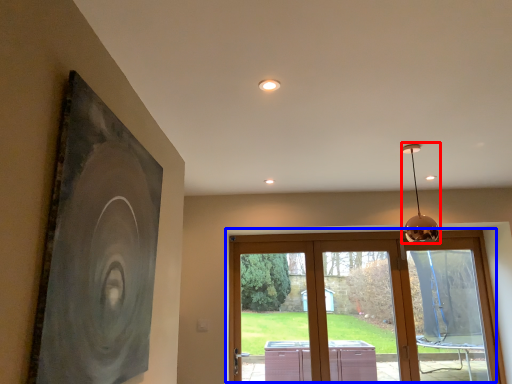
Question: Which object is further to the camera taking this photo, lamp (highlighted by a red box) or window (highlighted by a blue box)?

Choices:
 (A) lamp
 (B) window

Answer: (B)